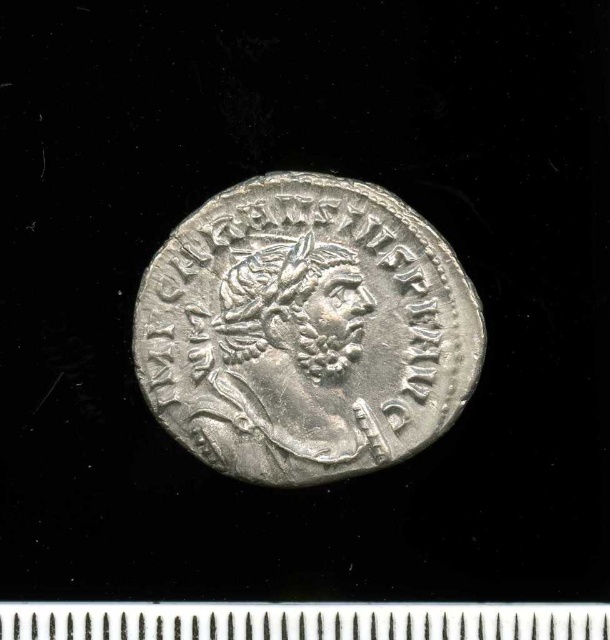
Does silver metallic coin at center have a lesser width compared to metallic ruler at bottom?

Correct, silver metallic coin at center's width is less than metallic ruler at bottom's.

Does silver metallic coin at center have a larger size compared to metallic ruler at bottom?

Indeed, silver metallic coin at center has a larger size compared to metallic ruler at bottom.

The height and width of the screenshot is (640, 610). Describe the element at coordinates (306, 330) in the screenshot. I see `silver metallic coin at center` at that location.

This screenshot has width=610, height=640. Find the location of `silver metallic coin at center`. silver metallic coin at center is located at coordinates (306, 330).